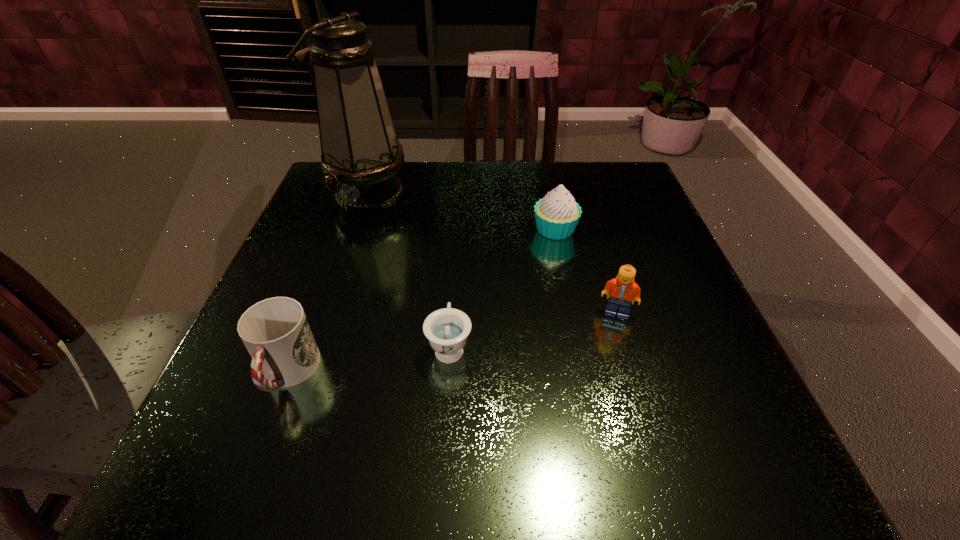
This screenshot has width=960, height=540. Find the location of `free space at the near edge`. free space at the near edge is located at coordinates (582, 451).

Locate an element on the screen. The width and height of the screenshot is (960, 540). vacant area at the left edge of the desktop is located at coordinates (246, 389).

Image resolution: width=960 pixels, height=540 pixels. I want to click on free space at the right edge, so click(x=658, y=266).

The height and width of the screenshot is (540, 960). Identify the location of blank area at the far right corner. (586, 197).

Locate an element on the screen. This screenshot has height=540, width=960. vacant space that's between the cup and the oil lamp is located at coordinates (327, 282).

Where is `free area in between the teacup and the cup`? This screenshot has height=540, width=960. free area in between the teacup and the cup is located at coordinates (369, 360).

Identify the location of vacant area that lies between the cupcake and the cup. (421, 301).

The width and height of the screenshot is (960, 540). Identify the location of free area in between the third farthest object and the second farthest object. (586, 271).

Identify the location of vacant area that lies between the cup and the second farthest object. The height and width of the screenshot is (540, 960). (421, 301).

What are the coordinates of `blank region between the tallest object and the shortest object` in the screenshot? It's located at (408, 269).